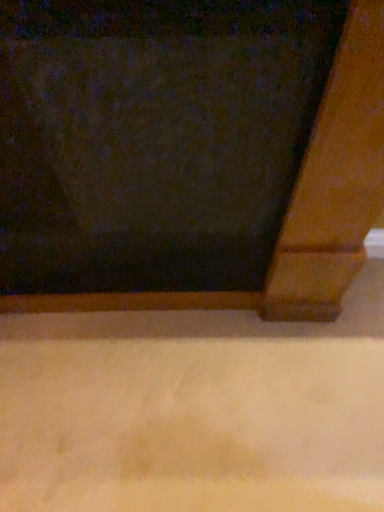
Where is `vacant region under matte wood frame at lower right (from a real-world perspective)`? The height and width of the screenshot is (512, 384). vacant region under matte wood frame at lower right (from a real-world perspective) is located at coordinates (157, 316).